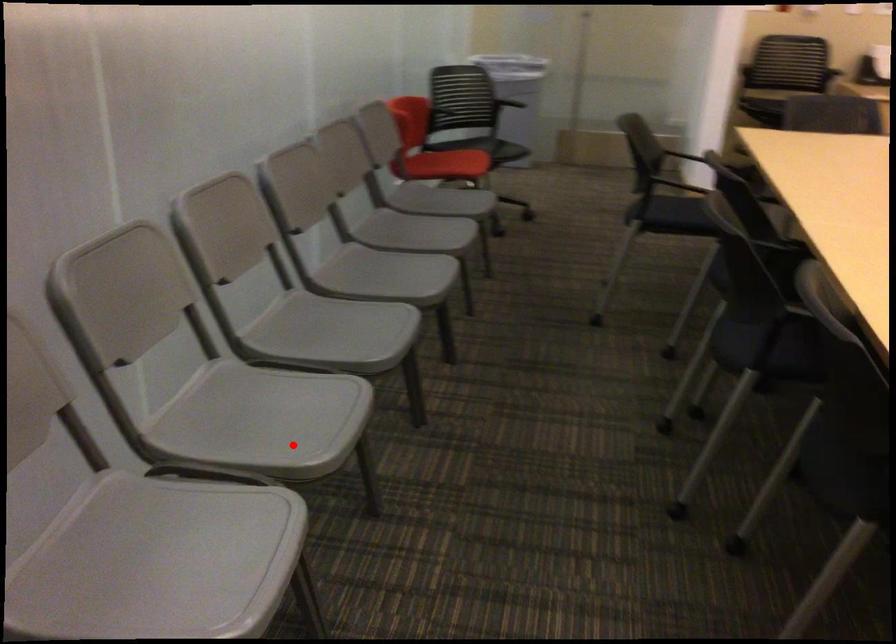
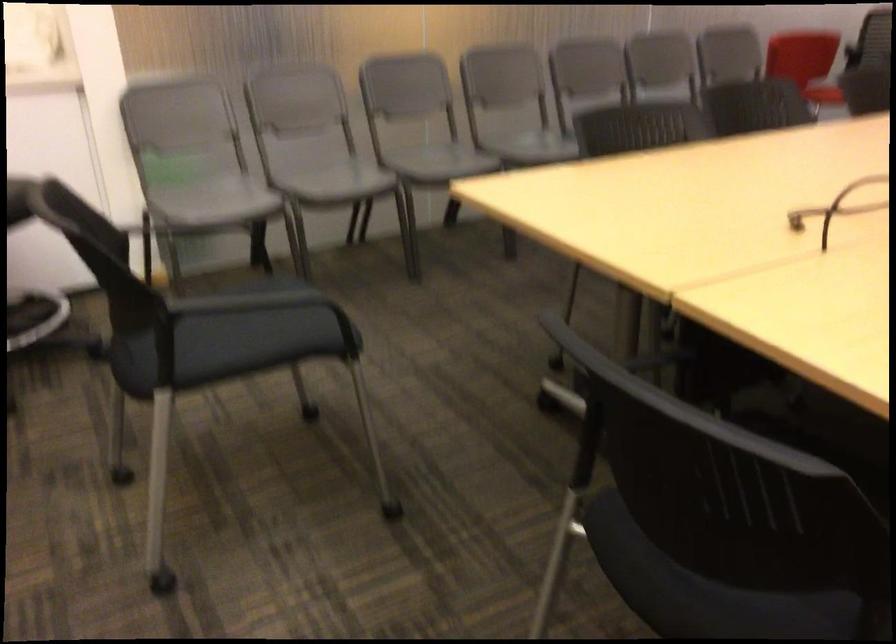
The point at the highlighted location is marked in the first image. Where is the corresponding point in the second image?

(436, 161)